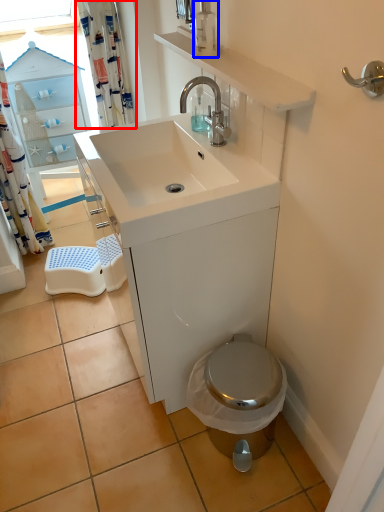
Question: Which point is further to the camera, shower curtain (highlighted by a red box) or soap dispenser (highlighted by a blue box)?

Choices:
 (A) shower curtain
 (B) soap dispenser

Answer: (A)